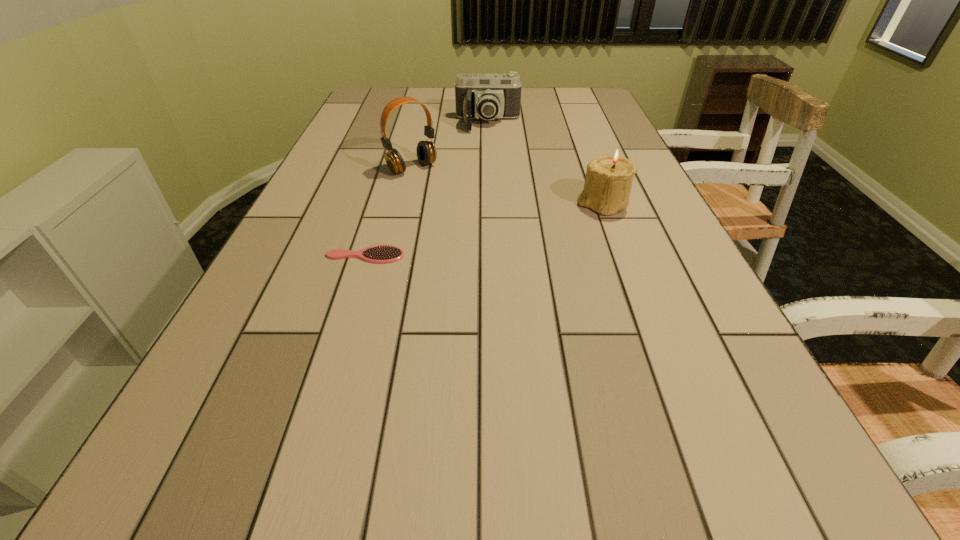
The height and width of the screenshot is (540, 960). I want to click on vacant space positioned on the ear cups of the tallest object, so click(x=508, y=249).

You are a GUI agent. You are given a task and a screenshot of the screen. Output one action in this format:
    pyautogui.click(x=<x>, y=<y>)
    Task: Click on the free region located on the ear cups of the tallest object
    Image resolution: width=960 pixels, height=540 pixels.
    Given the screenshot: What is the action you would take?
    pyautogui.click(x=511, y=252)

This screenshot has width=960, height=540. What are the coordinates of `free location located on the ear cups of the tallest object` in the screenshot? It's located at (482, 227).

The width and height of the screenshot is (960, 540). I want to click on free location located 0.260m at the front of the camera with an open lens cover, so click(x=489, y=174).

The width and height of the screenshot is (960, 540). I want to click on vacant space situated 0.320m at the front of the camera with an open lens cover, so click(x=489, y=186).

Find the location of a particular element. This screenshot has height=540, width=960. vacant space located at the front of the camera with an open lens cover is located at coordinates (489, 198).

I want to click on object that is at the left edge, so click(x=377, y=254).

Where is `object located at the right edge`? object located at the right edge is located at coordinates (608, 181).

Locate an element on the screen. The height and width of the screenshot is (540, 960). vacant space at the far edge of the desktop is located at coordinates (522, 107).

This screenshot has height=540, width=960. Find the location of `vacant space at the left edge of the desktop`. vacant space at the left edge of the desktop is located at coordinates (337, 168).